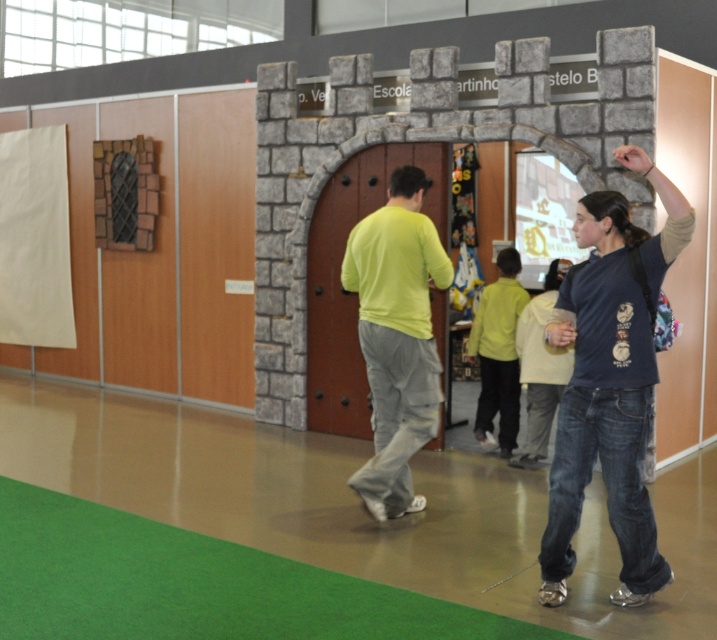
You are at an event and see the light green fabric shirt at center. Where exactly is it located in the image?

The light green fabric shirt at center is located at point (397, 337) in the image.

Based on the photo, you are at an event and see two garments displayed on mannequins in the center of a medieval castle theme display. The garments are a matte green shirt at center and a light yellow sweater at center. Which garment is positioned to the left?

The matte green shirt at center is positioned to the left of the light yellow sweater at center.